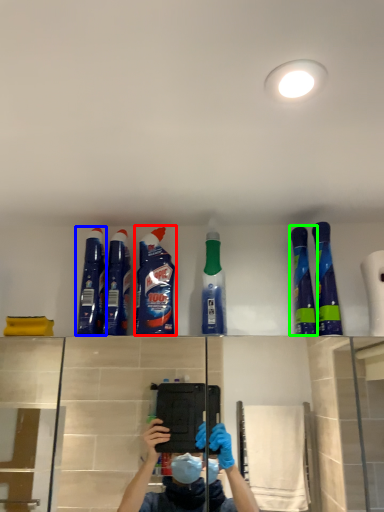
Question: Considering the real-world distances, which object is closest to cleaning product (highlighted by a red box)? cleaning product (highlighted by a blue box) or cleaning product (highlighted by a green box).

Choices:
 (A) cleaning product
 (B) cleaning product

Answer: (A)